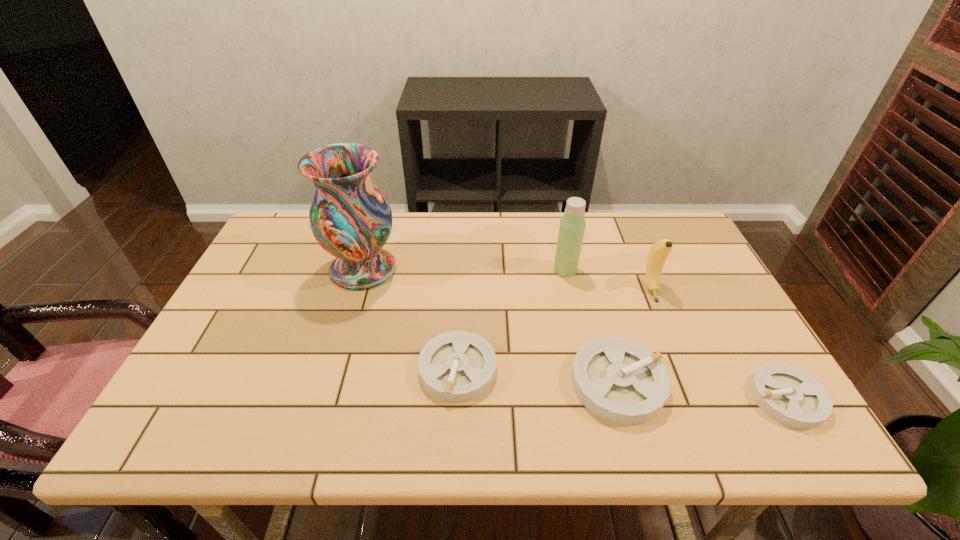
Image resolution: width=960 pixels, height=540 pixels. I want to click on blank area at the near edge, so click(300, 398).

Locate an element on the screen. The image size is (960, 540). vacant space at the left edge of the desktop is located at coordinates (291, 264).

In the image, there is a desktop. Where is `vacant space at the right edge`? Image resolution: width=960 pixels, height=540 pixels. vacant space at the right edge is located at coordinates (683, 273).

The width and height of the screenshot is (960, 540). Identify the location of free region at the far left corner. (293, 219).

Image resolution: width=960 pixels, height=540 pixels. In order to click on vacant area at the near left corner of the desktop in this screenshot , I will do `click(228, 397)`.

This screenshot has height=540, width=960. In order to click on free space between the second ashtray from right to left and the vase in this screenshot , I will do `click(491, 326)`.

This screenshot has width=960, height=540. What are the coordinates of `unoccupied position between the second object from right to left and the vase` in the screenshot? It's located at (507, 279).

Identify the location of free space that is in between the fourth shortest object and the second ashtray from left to right. The width and height of the screenshot is (960, 540). (635, 336).

I want to click on vacant area that lies between the third tallest object and the thermos bottle, so click(609, 280).

Identify the location of free space that is in between the rightmost object and the thermos bottle. (676, 334).